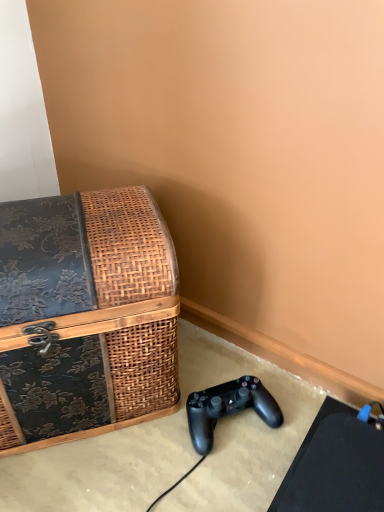
Question: Is woven wood trunk at left to the left of black matte game controller at lower right from the viewer's perspective?

Choices:
 (A) no
 (B) yes

Answer: (B)

Question: Is woven wood trunk at left placed right next to black matte game controller at lower right?

Choices:
 (A) yes
 (B) no

Answer: (B)

Question: From a real-world perspective, is woven wood trunk at left over black matte game controller at lower right?

Choices:
 (A) yes
 (B) no

Answer: (A)

Question: Is the position of woven wood trunk at left more distant than that of black matte game controller at lower right?

Choices:
 (A) yes
 (B) no

Answer: (B)

Question: Considering the relative sizes of woven wood trunk at left and black matte game controller at lower right in the image provided, is woven wood trunk at left bigger than black matte game controller at lower right?

Choices:
 (A) yes
 (B) no

Answer: (A)

Question: Is woven wood trunk at left outside of black matte game controller at lower right?

Choices:
 (A) no
 (B) yes

Answer: (B)

Question: From a real-world perspective, does black matte game controller at lower right stand above woven wood trunk at left?

Choices:
 (A) no
 (B) yes

Answer: (A)

Question: Could woven wood trunk at left be considered to be inside black matte game controller at lower right?

Choices:
 (A) yes
 (B) no

Answer: (B)

Question: Is black matte game controller at lower right shorter than woven wood trunk at left?

Choices:
 (A) no
 (B) yes

Answer: (B)

Question: Does black matte game controller at lower right have a greater height compared to woven wood trunk at left?

Choices:
 (A) yes
 (B) no

Answer: (B)

Question: Is the depth of black matte game controller at lower right greater than that of woven wood trunk at left?

Choices:
 (A) yes
 (B) no

Answer: (A)

Question: Does black matte game controller at lower right have a lesser width compared to woven wood trunk at left?

Choices:
 (A) no
 (B) yes

Answer: (B)

Question: In terms of size, does black matte game controller at lower right appear bigger or smaller than woven wood trunk at left?

Choices:
 (A) big
 (B) small

Answer: (B)